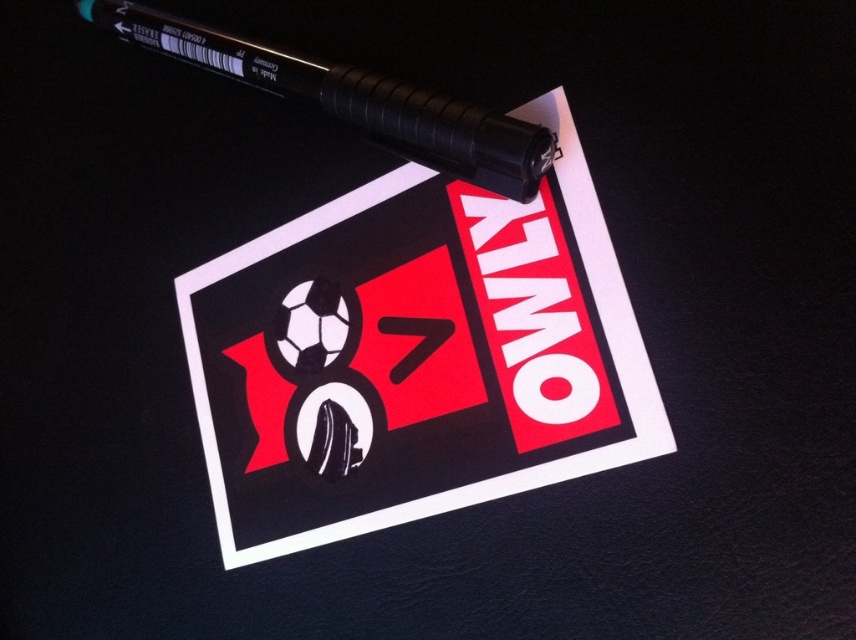
Question: Is white paper at upper center to the right of black rubber pen at upper left from the viewer's perspective?

Choices:
 (A) no
 (B) yes

Answer: (B)

Question: Is white paper at upper center above black rubber pen at upper left?

Choices:
 (A) no
 (B) yes

Answer: (A)

Question: Which of the following is the farthest from the observer?

Choices:
 (A) white paper at upper center
 (B) black rubber pen at upper left

Answer: (B)

Question: Does white paper at upper center have a larger size compared to black rubber pen at upper left?

Choices:
 (A) yes
 (B) no

Answer: (A)